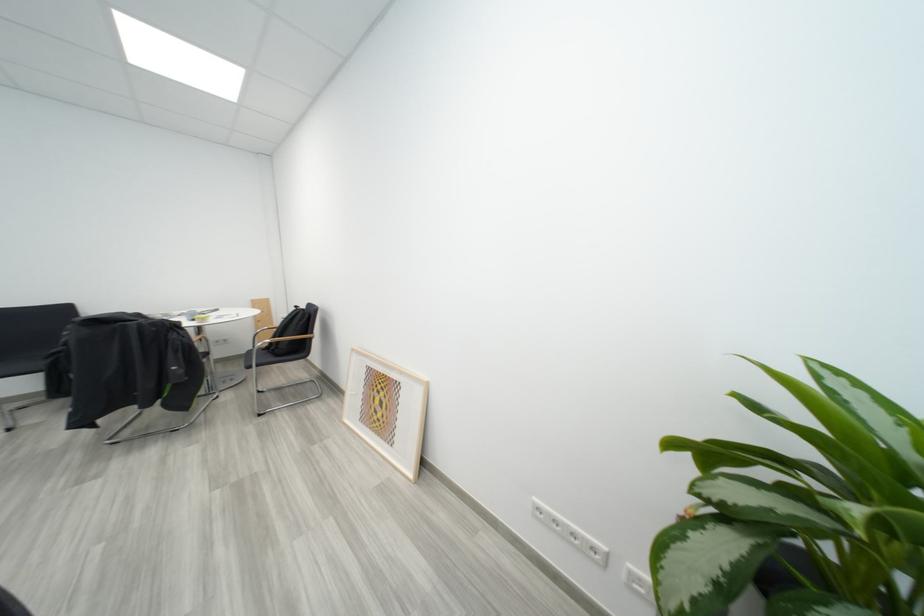
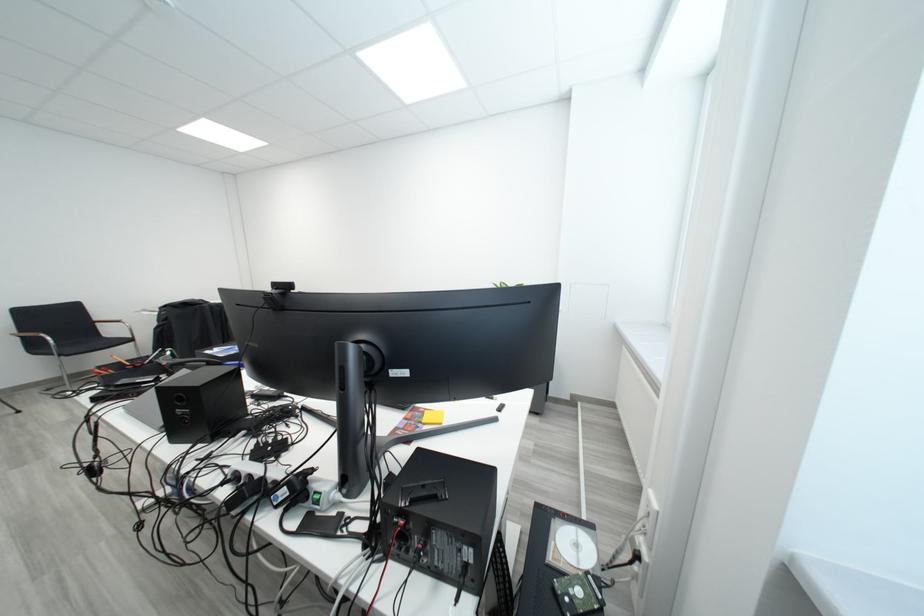
Question: Which direction would the cameraman need to move to produce the second image? Reply with the corresponding letter.

Choices:
 (A) Left
 (B) Right
 (C) Forward
 (D) Backward

Answer: (D)